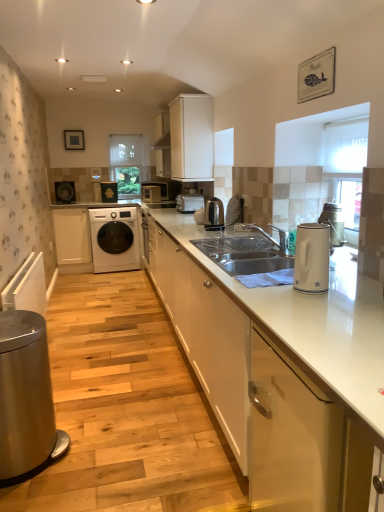
Where is `vacant space situated on the left part of satin nickel kettle at center, which is the fourth appliance in left-to-right order`? Image resolution: width=384 pixels, height=512 pixels. vacant space situated on the left part of satin nickel kettle at center, which is the fourth appliance in left-to-right order is located at coordinates (189, 230).